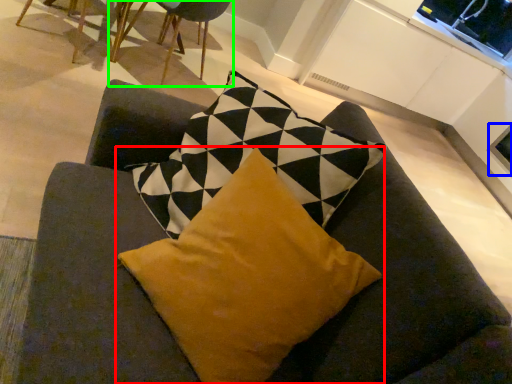
Question: Based on their relative distances, which object is nearer to pillow (highlighted by a red box)? Choose from window screen (highlighted by a blue box) and chair (highlighted by a green box).

Choices:
 (A) window screen
 (B) chair

Answer: (B)